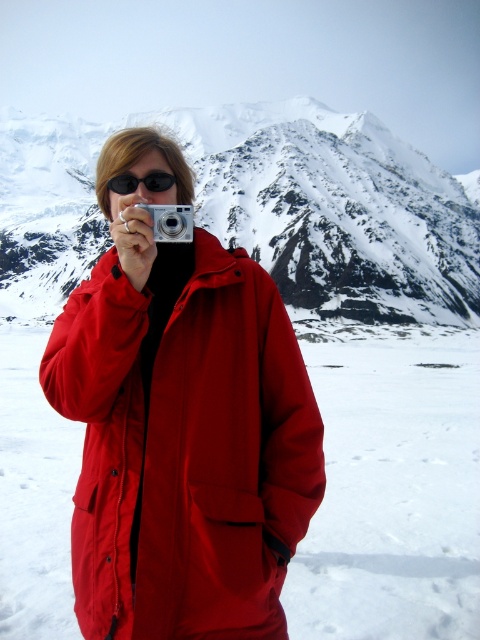
Question: Estimate the real-world distances between objects in this image. Which object is closer to the black plastic goggles at center?

Choices:
 (A) silver metallic camera at center
 (B) snowy granite mountain at upper center
 (C) matte red jacket at center

Answer: (A)

Question: Which point is farther to the camera?

Choices:
 (A) black plastic goggles at center
 (B) silver metallic camera at center

Answer: (A)

Question: Is the position of snowy granite mountain at upper center more distant than that of silver metallic camera at center?

Choices:
 (A) no
 (B) yes

Answer: (B)

Question: Can you confirm if snowy granite mountain at upper center is smaller than silver metallic camera at center?

Choices:
 (A) no
 (B) yes

Answer: (A)

Question: Can you confirm if matte red jacket at center is bigger than snowy granite mountain at upper center?

Choices:
 (A) no
 (B) yes

Answer: (A)

Question: Which object appears farthest from the camera in this image?

Choices:
 (A) silver metallic camera at center
 (B) matte red jacket at center

Answer: (A)